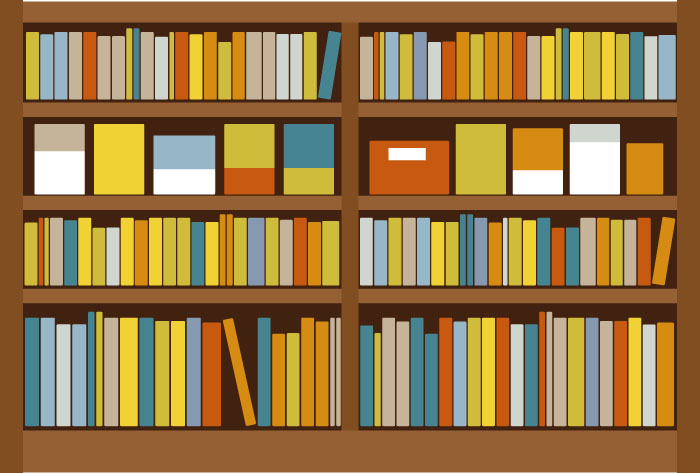
Image resolution: width=700 pixels, height=473 pixels. Identify the location of shelf. (208, 430), (209, 295), (201, 204), (201, 108), (196, 14), (517, 9), (517, 110), (516, 203), (516, 297), (512, 434).